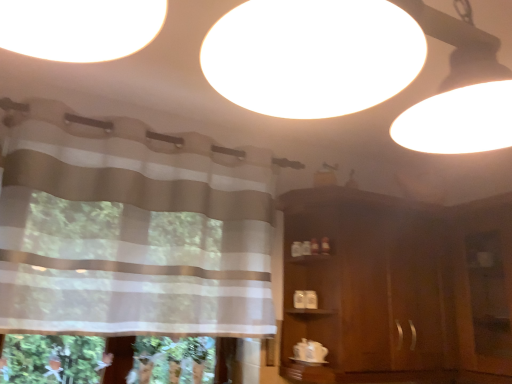
Question: Does striped fabric curtain at upper left have a lesser height compared to brown wooden dresser at right?

Choices:
 (A) yes
 (B) no

Answer: (A)

Question: Could you tell me if striped fabric curtain at upper left is facing brown wooden dresser at right?

Choices:
 (A) yes
 (B) no

Answer: (B)

Question: From the image's perspective, is striped fabric curtain at upper left on top of brown wooden dresser at right?

Choices:
 (A) yes
 (B) no

Answer: (A)

Question: Are striped fabric curtain at upper left and brown wooden dresser at right located far from each other?

Choices:
 (A) no
 (B) yes

Answer: (A)

Question: From a real-world perspective, is striped fabric curtain at upper left on brown wooden dresser at right?

Choices:
 (A) yes
 (B) no

Answer: (A)

Question: Does striped fabric curtain at upper left have a smaller size compared to brown wooden dresser at right?

Choices:
 (A) yes
 (B) no

Answer: (A)

Question: Can you confirm if brown wooden dresser at right is thinner than transparent plastic screen door at right?

Choices:
 (A) yes
 (B) no

Answer: (B)

Question: Is transparent plastic screen door at right a part of brown wooden dresser at right?

Choices:
 (A) no
 (B) yes

Answer: (A)

Question: Is brown wooden dresser at right at the left side of transparent plastic screen door at right?

Choices:
 (A) yes
 (B) no

Answer: (A)

Question: Is brown wooden dresser at right turned away from transparent plastic screen door at right?

Choices:
 (A) no
 (B) yes

Answer: (A)

Question: Is brown wooden dresser at right completely or partially outside of transparent plastic screen door at right?

Choices:
 (A) no
 (B) yes

Answer: (B)

Question: Does brown wooden dresser at right lie behind transparent plastic screen door at right?

Choices:
 (A) no
 (B) yes

Answer: (B)

Question: From a real-world perspective, is transparent plastic screen door at right below brown wooden dresser at right?

Choices:
 (A) no
 (B) yes

Answer: (B)